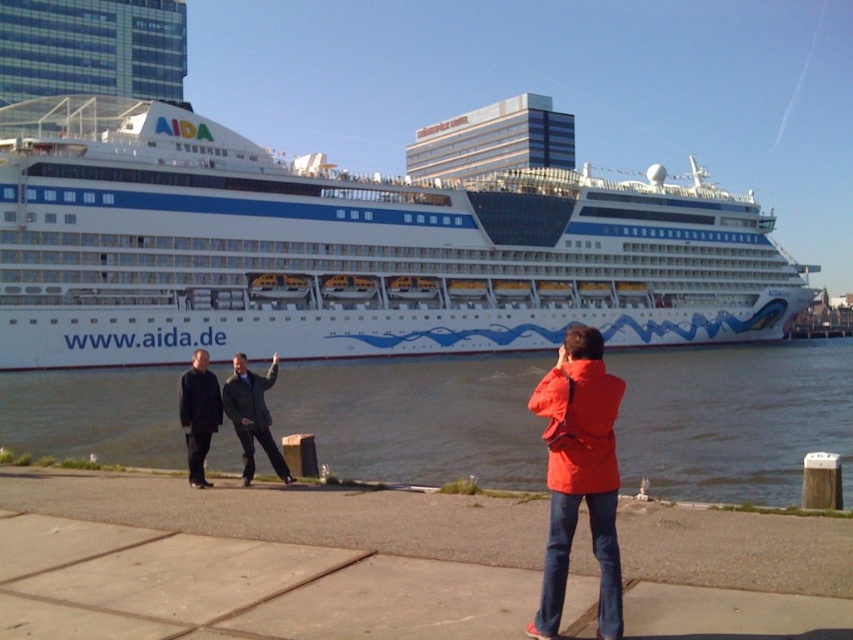
Based on the coordinates provided, what is the primary object located at point (347, 250) in the waterfront scene?

The point (347, 250) marks the white glossy cruise ship at center.

You are a photographer standing on the waterfront and want to take a photo of both the white glossy cruise ship at center and the dark gray wool coat at center. The minimum distance required between the subjects for your camera lens to focus properly is 35 meters. Will you be able to capture both subjects in focus?

The white glossy cruise ship at center and dark gray wool coat at center are 34.93 meters apart from each other. Since the required distance is 35 meters, the current separation is just below the threshold, so the camera may struggle to keep both in focus. It might be advisable to move slightly back or adjust the composition to increase the distance between them.